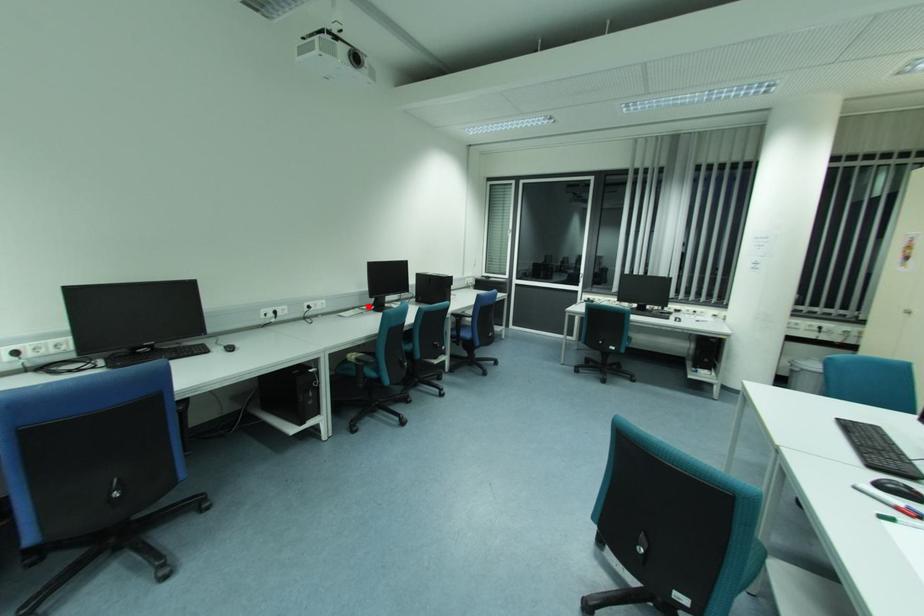
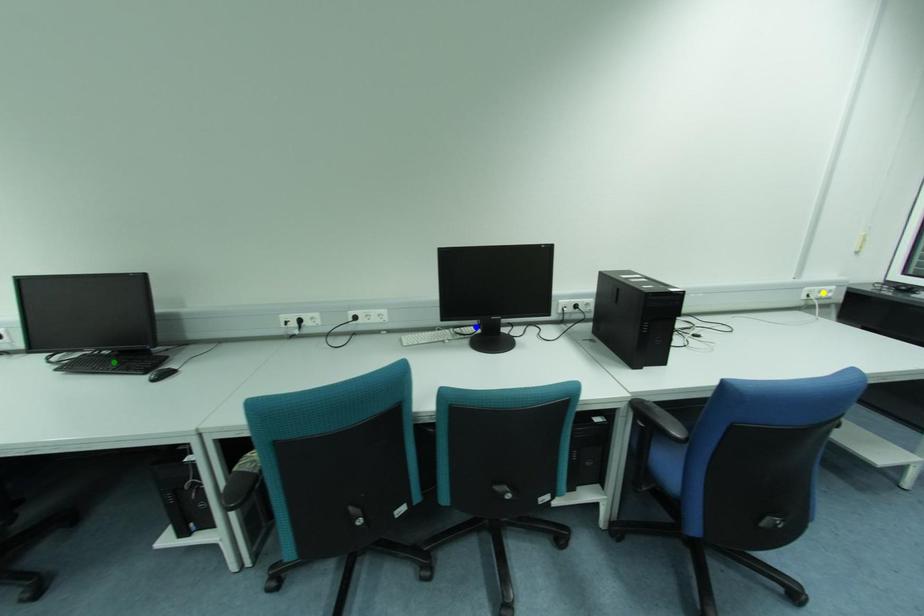
Question: I am providing you with two images of the same scene from different viewpoints. A red point is marked on the first image. You are given multiple points on the second image. Which point in image 2 represents the same 3d spot as the red point in image 1?

Choices:
 (A) blue point
 (B) yellow point
 (C) green point

Answer: (A)